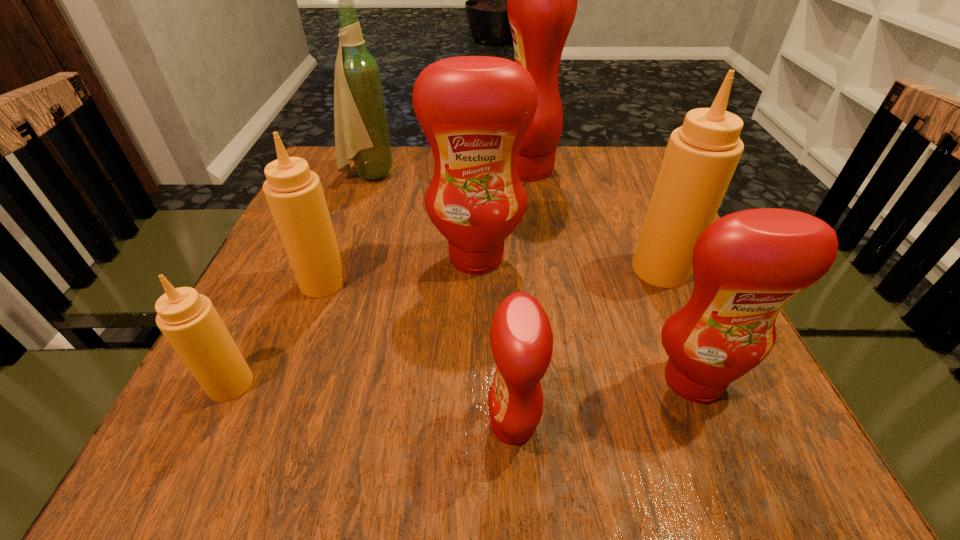
I want to click on the tallest condiment, so click(542, 0).

The width and height of the screenshot is (960, 540). Identify the location of the biggest red condiment. 542,0.

You are a GUI agent. You are given a task and a screenshot of the screen. Output one action in this format:
    pyautogui.click(x=<x>, y=<y>)
    Task: Click on the wine bottle
    
    Given the screenshot: What is the action you would take?
    pyautogui.click(x=362, y=136)

Find the location of a particular element. The width and height of the screenshot is (960, 540). the biggest tan condiment is located at coordinates (701, 156).

Find the location of `the third smallest red condiment`. the third smallest red condiment is located at coordinates (475, 111).

This screenshot has height=540, width=960. Find the location of `the second smallest tan condiment`. the second smallest tan condiment is located at coordinates (294, 193).

Find the location of a particular element. The image size is (960, 540). the second tan condiment from right to left is located at coordinates (294, 193).

Find the location of `the third biggest red condiment`. the third biggest red condiment is located at coordinates (747, 265).

The image size is (960, 540). Identify the location of the smallest red condiment. (521, 338).

I want to click on the smallest tan condiment, so click(189, 321).